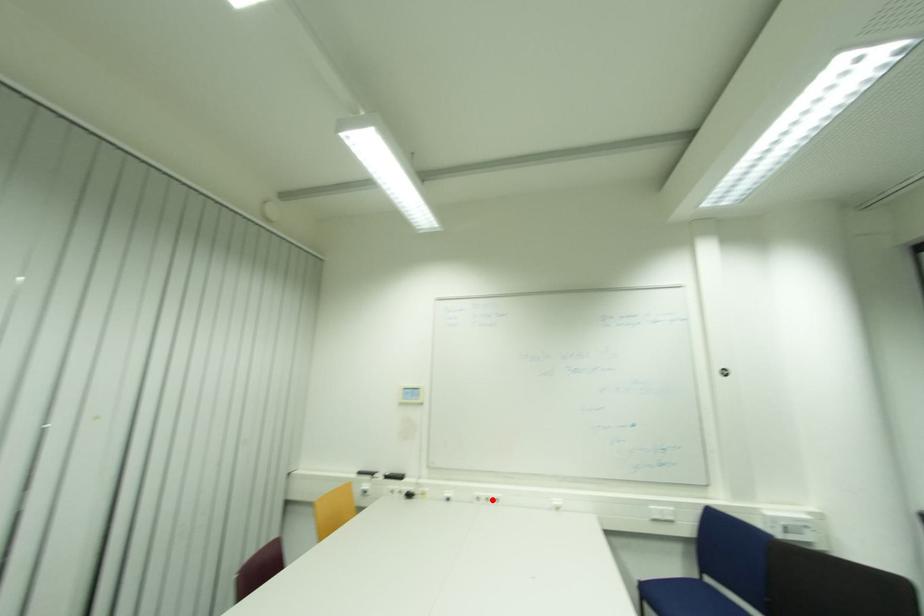
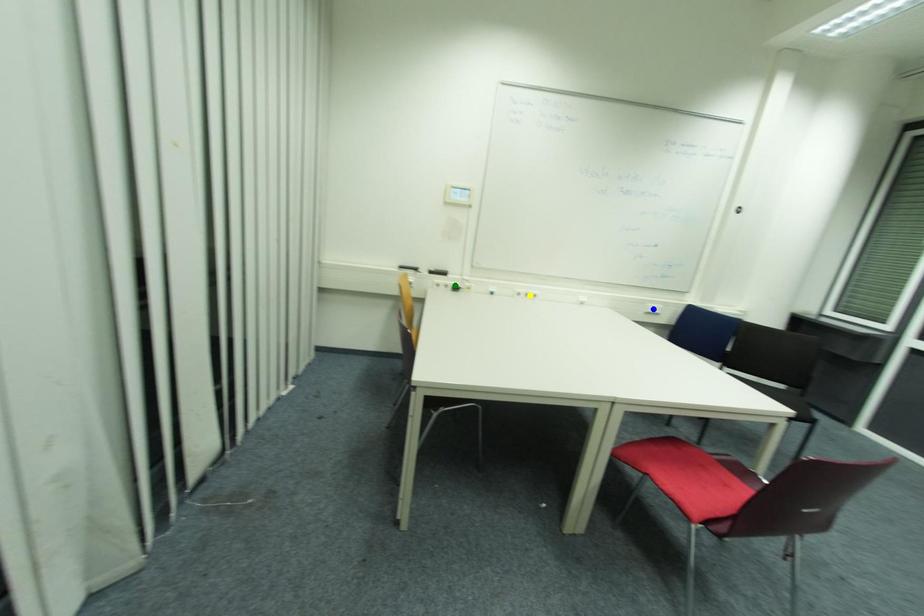
Question: I am providing you with two images of the same scene from different viewpoints. A red point is marked on the first image. You are given multiple points on the second image. In image 2, which mark is for the same physical point as the one in image 1?

Choices:
 (A) green point
 (B) blue point
 (C) yellow point

Answer: (C)